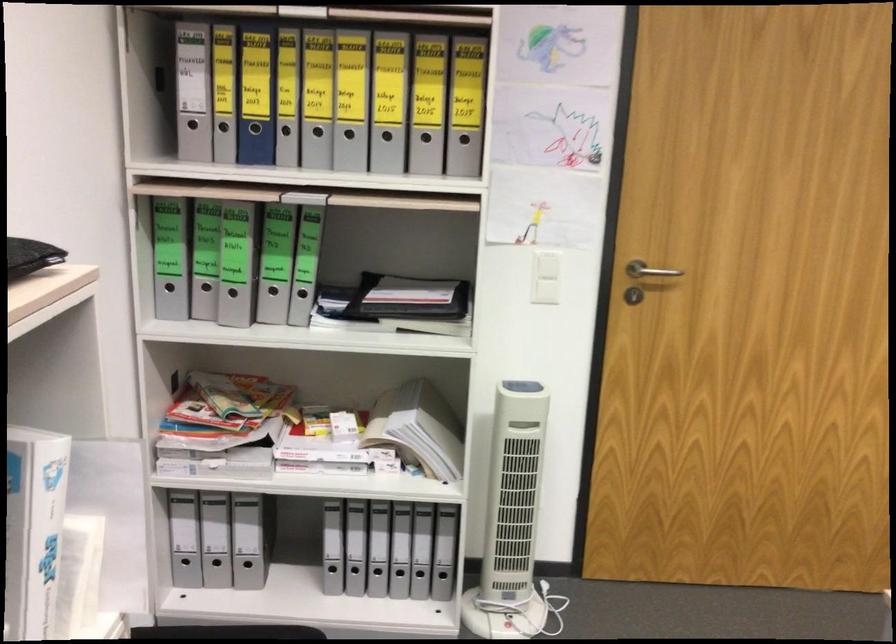
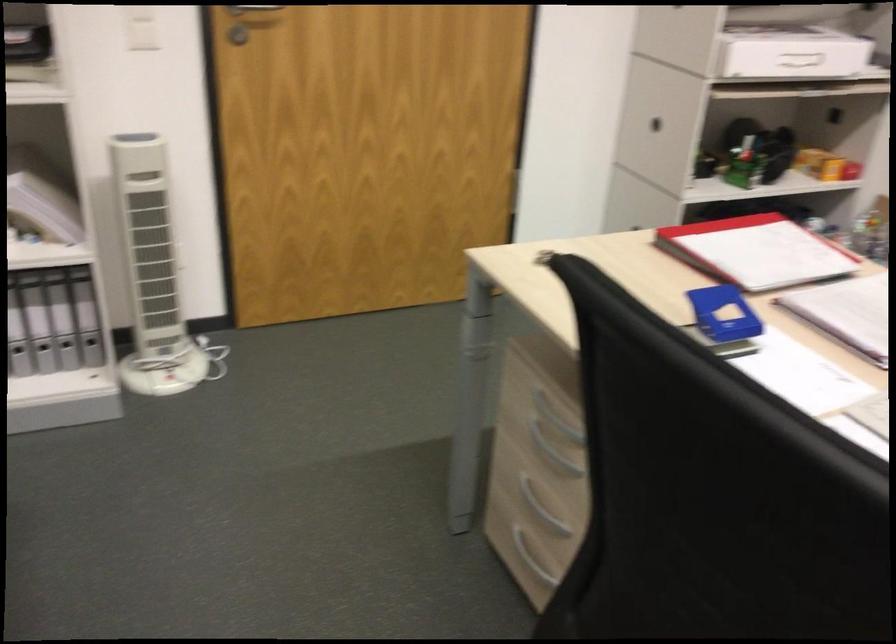
The point at (375, 571) is marked in the first image. Where is the corresponding point in the second image?

(16, 348)